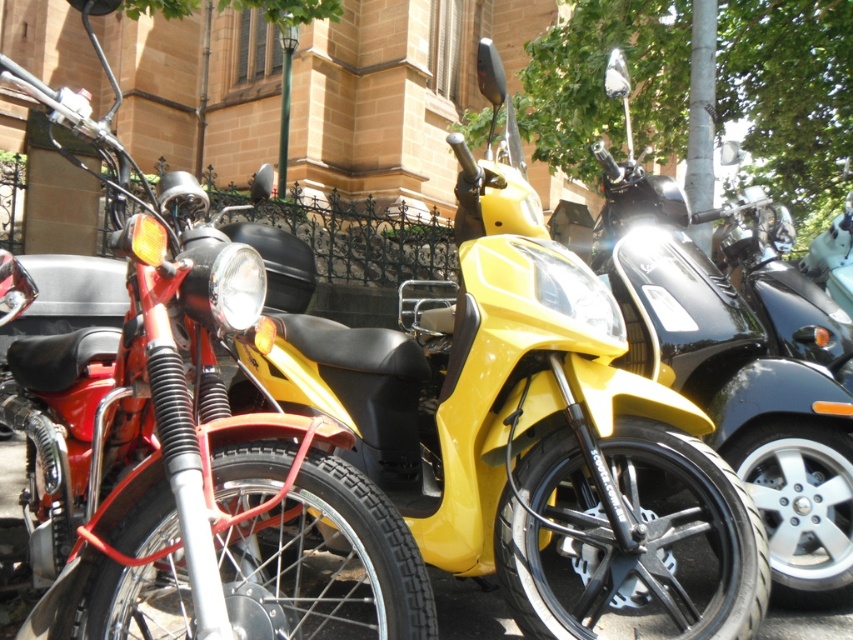
Question: Estimate the real-world distances between objects in this image. Which object is farther from the yellow matte scooter at center?

Choices:
 (A) shiny black scooter at center
 (B) matte black motorcycle at left

Answer: (B)

Question: Which of these objects is positioned closest to the yellow matte scooter at center?

Choices:
 (A) matte black motorcycle at left
 (B) shiny black scooter at center

Answer: (B)

Question: Can you confirm if yellow matte scooter at center is positioned above shiny black scooter at center?

Choices:
 (A) yes
 (B) no

Answer: (B)

Question: Which object appears closest to the camera in this image?

Choices:
 (A) shiny black scooter at center
 (B) matte black motorcycle at left
 (C) yellow matte scooter at center

Answer: (B)

Question: Does matte black motorcycle at left have a greater width compared to shiny black scooter at center?

Choices:
 (A) yes
 (B) no

Answer: (A)

Question: From the image, what is the correct spatial relationship of yellow matte scooter at center in relation to shiny black scooter at center?

Choices:
 (A) above
 (B) below

Answer: (B)